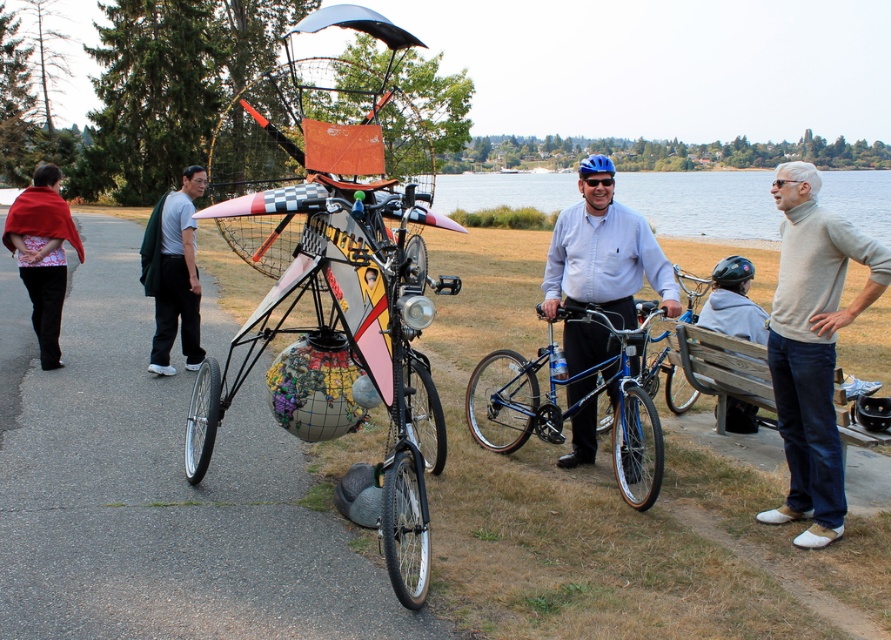
Question: Which of the following is the farthest from the observer?

Choices:
 (A) (845, 241)
 (B) (53, 189)
 (C) (170, 605)

Answer: (B)

Question: Is blue glossy shirt at center wider than gray fleece jacket at lower right?

Choices:
 (A) no
 (B) yes

Answer: (B)

Question: Which point is farther from the camera taking this photo?

Choices:
 (A) (538, 307)
 (B) (192, 218)
 (C) (838, 317)
 (D) (252, 576)

Answer: (B)

Question: Is the position of green fabric backpack at left more distant than that of gray fleece jacket at lower right?

Choices:
 (A) yes
 (B) no

Answer: (A)

Question: Which object is positioned farthest from the red fabric shawl at left?

Choices:
 (A) gray sweater at right
 (B) metallic bicycle at center
 (C) gray fleece jacket at lower right

Answer: (A)

Question: Is blue glossy shirt at center smaller than gray fleece jacket at lower right?

Choices:
 (A) no
 (B) yes

Answer: (A)